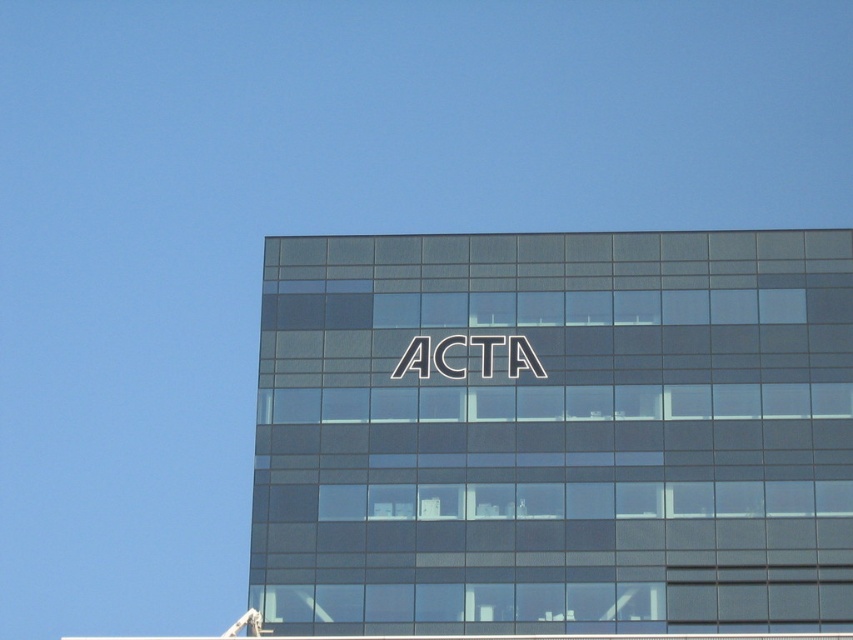
Question: Does satin glass building at center come in front of white metallic logo at center?

Choices:
 (A) yes
 (B) no

Answer: (A)

Question: Does satin glass building at center come in front of white metallic logo at center?

Choices:
 (A) no
 (B) yes

Answer: (B)

Question: Among these points, which one is nearest to the camera?

Choices:
 (A) (270, 481)
 (B) (508, 346)

Answer: (A)

Question: Does satin glass building at center appear on the right side of white metallic logo at center?

Choices:
 (A) no
 (B) yes

Answer: (B)

Question: Which point is closer to the camera?

Choices:
 (A) satin glass building at center
 (B) white metallic logo at center

Answer: (A)